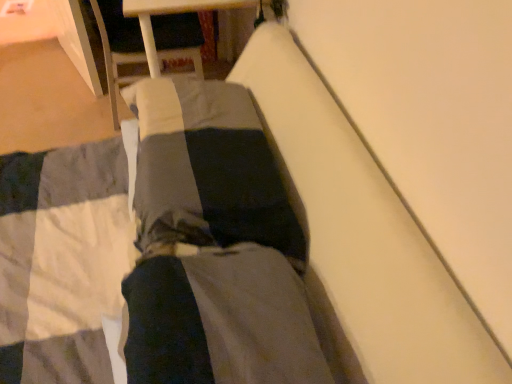
Question: Can you confirm if dark gray fabric at center is bigger than dark gray cotton pants at center?

Choices:
 (A) no
 (B) yes

Answer: (B)

Question: Can we say dark gray fabric at center lies outside dark gray cotton pants at center?

Choices:
 (A) yes
 (B) no

Answer: (A)

Question: Can you confirm if dark gray fabric at center is thinner than dark gray cotton pants at center?

Choices:
 (A) yes
 (B) no

Answer: (A)

Question: Is dark gray fabric at center not near dark gray cotton pants at center?

Choices:
 (A) yes
 (B) no

Answer: (B)

Question: Is dark gray fabric at center placed right next to dark gray cotton pants at center?

Choices:
 (A) yes
 (B) no

Answer: (A)

Question: Can you confirm if dark gray fabric at center is smaller than dark gray cotton pants at center?

Choices:
 (A) yes
 (B) no

Answer: (B)

Question: Is dark gray cotton pants at center looking in the opposite direction of dark gray fabric at center?

Choices:
 (A) yes
 (B) no

Answer: (B)

Question: Is dark gray cotton pants at center with dark gray fabric at center?

Choices:
 (A) no
 (B) yes

Answer: (B)

Question: Is dark gray cotton pants at center taller than dark gray fabric at center?

Choices:
 (A) no
 (B) yes

Answer: (B)

Question: Can you confirm if dark gray cotton pants at center is smaller than dark gray fabric at center?

Choices:
 (A) no
 (B) yes

Answer: (B)

Question: Does dark gray cotton pants at center appear on the left side of dark gray fabric at center?

Choices:
 (A) no
 (B) yes

Answer: (A)

Question: Is there a large distance between dark gray cotton pants at center and dark gray fabric at center?

Choices:
 (A) yes
 (B) no

Answer: (B)

Question: Considering their positions, is dark gray cotton pants at center located in front of or behind dark gray fabric at center?

Choices:
 (A) behind
 (B) front

Answer: (B)